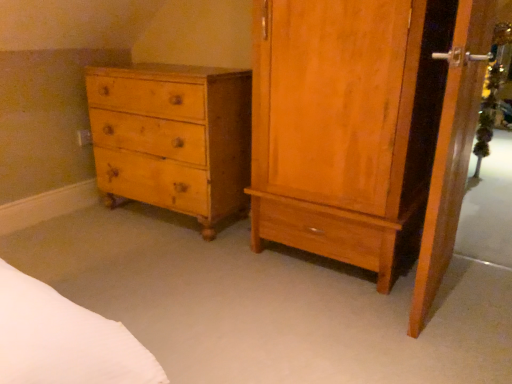
You are a GUI agent. You are given a task and a screenshot of the screen. Output one action in this format:
    pyautogui.click(x=<x>, y=<y>)
    Task: Click on the empty space that is to the right of wooden screen door at right
    This screenshot has width=512, height=384.
    Given the screenshot: What is the action you would take?
    pyautogui.click(x=481, y=294)